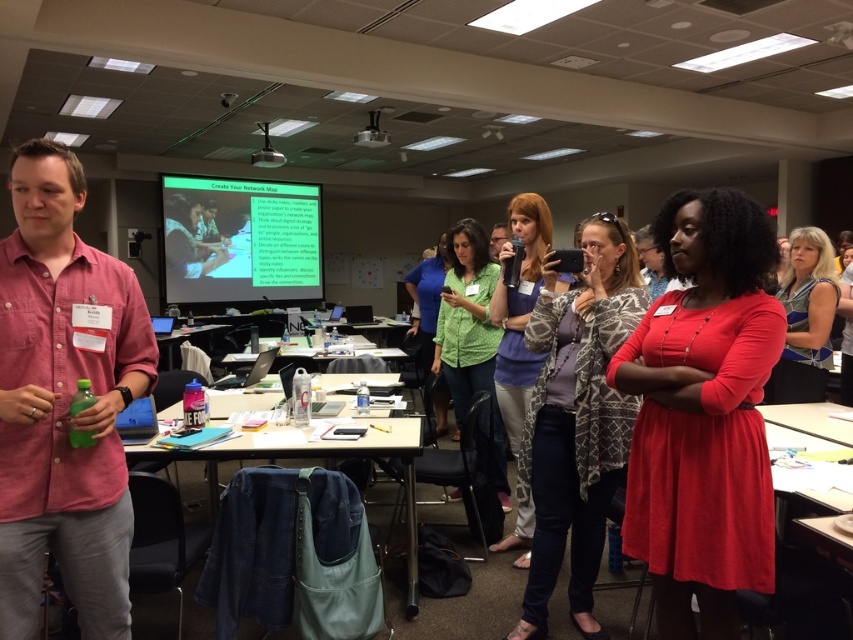
Can you confirm if red matte dress at center is positioned to the right of wooden table at center?

Yes, red matte dress at center is to the right of wooden table at center.

Who is positioned more to the left, red matte dress at center or wooden table at center?

wooden table at center is more to the left.

Is point (747, 488) positioned behind point (183, 326)?

No.

The height and width of the screenshot is (640, 853). What are the coordinates of `red matte dress at center` in the screenshot? It's located at (703, 413).

Can you confirm if green matte projector screen at center is thinner than wooden table at center?

Incorrect, green matte projector screen at center's width is not less than wooden table at center's.

This screenshot has width=853, height=640. In order to click on green matte projector screen at center in this screenshot , I will do `click(241, 240)`.

Find the location of `green matte projector screen at center`. green matte projector screen at center is located at coordinates (241, 240).

Image resolution: width=853 pixels, height=640 pixels. Identify the location of green matte projector screen at center. (241, 240).

Looking at this image, does pink cotton shirt at left have a smaller size compared to white plastic table at center?

Yes, pink cotton shirt at left is smaller than white plastic table at center.

Can you confirm if pink cotton shirt at left is positioned to the left of white plastic table at center?

No, pink cotton shirt at left is not to the left of white plastic table at center.

Who is more distant from viewer, (152,374) or (368,346)?

Point (368,346)

This screenshot has width=853, height=640. What are the coordinates of `pink cotton shirt at left` in the screenshot? It's located at (64, 401).